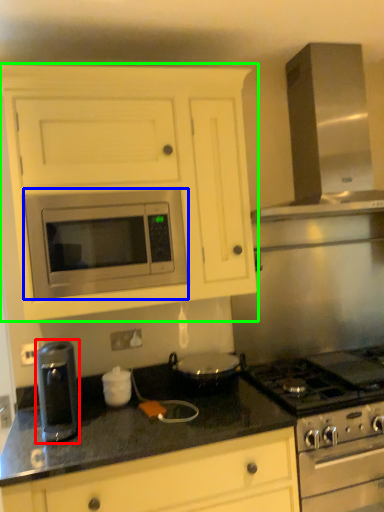
Question: Which object is positioned closest to kitchen appliance (highlighted by a red box)? Select from microwave oven (highlighted by a blue box) and cabinetry (highlighted by a green box).

Choices:
 (A) microwave oven
 (B) cabinetry

Answer: (A)